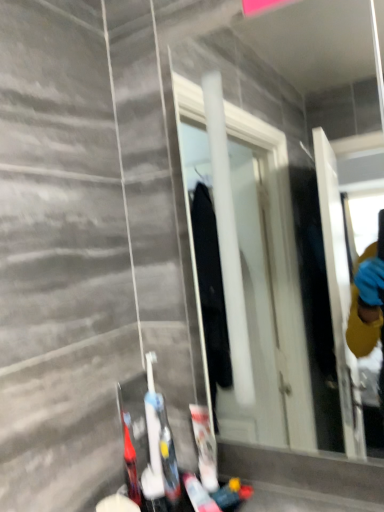
Question: From a real-world perspective, is white glossy mirror at center located higher than translucent plastic toothbrush at lower left, which is the third toiletry from right to left?

Choices:
 (A) yes
 (B) no

Answer: (A)

Question: Is white glossy mirror at center smaller than translucent plastic toothbrush at lower left, which is the third toiletry from right to left?

Choices:
 (A) yes
 (B) no

Answer: (B)

Question: From the image's perspective, would you say white glossy mirror at center is positioned over translucent plastic toothbrush at lower left, which is the third toiletry from right to left?

Choices:
 (A) yes
 (B) no

Answer: (A)

Question: Does white glossy mirror at center come behind translucent plastic toothbrush at lower left, which is the third toiletry from right to left?

Choices:
 (A) no
 (B) yes

Answer: (A)

Question: Is white glossy mirror at center positioned before translucent plastic toothbrush at lower left, the first toiletry positioned from the left?

Choices:
 (A) yes
 (B) no

Answer: (A)

Question: Considering the relative sizes of white glossy mirror at center and translucent plastic toothbrush at lower left, the first toiletry positioned from the left, in the image provided, is white glossy mirror at center taller than translucent plastic toothbrush at lower left, the first toiletry positioned from the left,?

Choices:
 (A) yes
 (B) no

Answer: (A)

Question: Can you confirm if translucent plastic toothbrush at lower left, the first toiletry positioned from the left, is shorter than white plastic toothbrush at lower center, the second toiletry in the right-to-left sequence?

Choices:
 (A) no
 (B) yes

Answer: (B)

Question: Can you confirm if translucent plastic toothbrush at lower left, the first toiletry positioned from the left, is positioned to the left of white plastic toothbrush at lower center, the second toiletry in the right-to-left sequence?

Choices:
 (A) yes
 (B) no

Answer: (A)

Question: Is translucent plastic toothbrush at lower left, the first toiletry positioned from the left, smaller than white plastic toothbrush at lower center, the second toiletry from the left?

Choices:
 (A) no
 (B) yes

Answer: (B)

Question: Is translucent plastic toothbrush at lower left, the first toiletry positioned from the left, positioned in front of white plastic toothbrush at lower center, the second toiletry from the left?

Choices:
 (A) yes
 (B) no

Answer: (B)

Question: Would you say translucent plastic toothbrush at lower left, which is the third toiletry from right to left, contains white plastic toothbrush at lower center, the second toiletry in the right-to-left sequence?

Choices:
 (A) yes
 (B) no

Answer: (B)

Question: Considering the relative sizes of translucent plastic toothbrush at lower left, which is the third toiletry from right to left, and white plastic toothbrush at lower center, the second toiletry from the left, in the image provided, is translucent plastic toothbrush at lower left, which is the third toiletry from right to left, taller than white plastic toothbrush at lower center, the second toiletry from the left,?

Choices:
 (A) yes
 (B) no

Answer: (B)

Question: Does white glossy mirror at center have a greater width compared to white matte toothpaste tube at lower center, placed as the 3th toiletry when sorted from left to right?

Choices:
 (A) no
 (B) yes

Answer: (B)